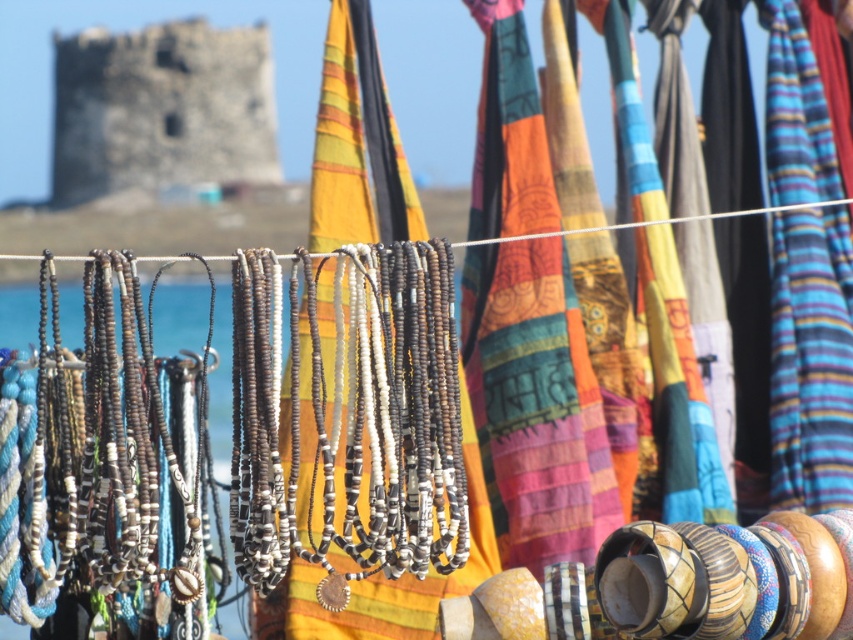
Question: Is silver metallic beads at center behind stone tower at upper left?

Choices:
 (A) no
 (B) yes

Answer: (A)

Question: Is silver metallic beads at center to the right of stone tower at upper left from the viewer's perspective?

Choices:
 (A) yes
 (B) no

Answer: (A)

Question: Is silver metallic beads at center to the left of stone tower at upper left from the viewer's perspective?

Choices:
 (A) yes
 (B) no

Answer: (B)